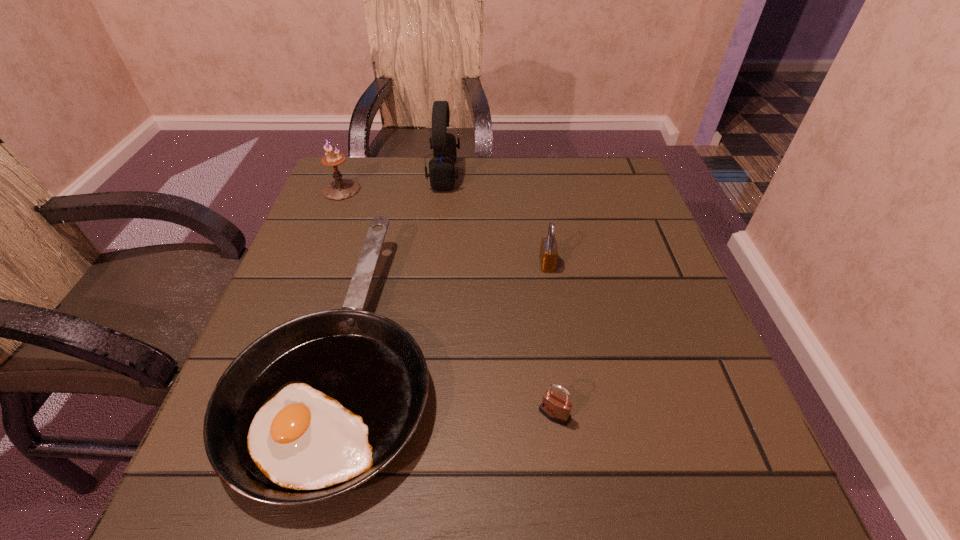
Find the location of a particular element. This screenshot has width=960, height=540. free location that satisfies the following two spatial constraints: 1. on the back side of the third shortest object; 2. on the headband of the headset is located at coordinates (533, 174).

Locate an element on the screen. Image resolution: width=960 pixels, height=540 pixels. free space that satisfies the following two spatial constraints: 1. on the headband of the headset; 2. on the left side of the shorter padlock is located at coordinates pos(420,414).